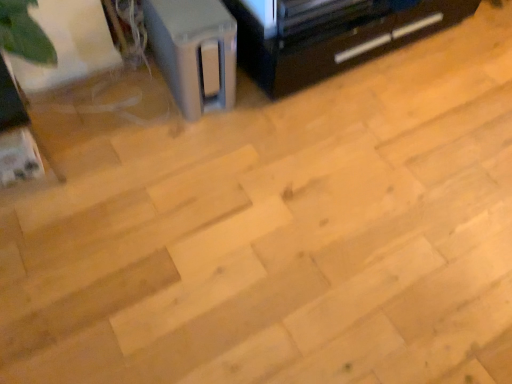
Question: Does black plastic tv stand at upper right have a greater width compared to satin gray speaker at upper left?

Choices:
 (A) yes
 (B) no

Answer: (B)

Question: Can you confirm if black plastic tv stand at upper right is shorter than satin gray speaker at upper left?

Choices:
 (A) yes
 (B) no

Answer: (A)

Question: Is black plastic tv stand at upper right at the left side of satin gray speaker at upper left?

Choices:
 (A) yes
 (B) no

Answer: (B)

Question: Does black plastic tv stand at upper right turn towards satin gray speaker at upper left?

Choices:
 (A) no
 (B) yes

Answer: (A)

Question: Can you confirm if black plastic tv stand at upper right is positioned to the right of satin gray speaker at upper left?

Choices:
 (A) no
 (B) yes

Answer: (B)

Question: Is black plastic tv stand at upper right facing away from satin gray speaker at upper left?

Choices:
 (A) yes
 (B) no

Answer: (B)

Question: Considering the relative sizes of satin gray speaker at upper left and black plastic tv stand at upper right in the image provided, is satin gray speaker at upper left bigger than black plastic tv stand at upper right?

Choices:
 (A) no
 (B) yes

Answer: (A)

Question: Is satin gray speaker at upper left touching black plastic tv stand at upper right?

Choices:
 (A) yes
 (B) no

Answer: (B)

Question: Is satin gray speaker at upper left positioned behind black plastic tv stand at upper right?

Choices:
 (A) yes
 (B) no

Answer: (B)

Question: Are satin gray speaker at upper left and black plastic tv stand at upper right located far from each other?

Choices:
 (A) no
 (B) yes

Answer: (A)

Question: Does satin gray speaker at upper left have a greater width compared to black plastic tv stand at upper right?

Choices:
 (A) yes
 (B) no

Answer: (A)

Question: Is satin gray speaker at upper left looking in the opposite direction of black plastic tv stand at upper right?

Choices:
 (A) no
 (B) yes

Answer: (A)

Question: Is satin gray speaker at upper left wider or thinner than black plastic tv stand at upper right?

Choices:
 (A) thin
 (B) wide

Answer: (B)